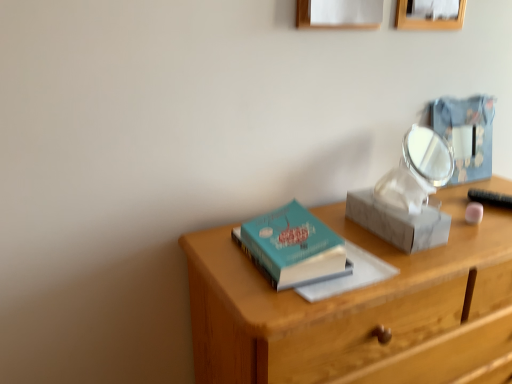
The height and width of the screenshot is (384, 512). Find the location of `free spot above teal matte hardcover book at center (from a real-world perspective)`. free spot above teal matte hardcover book at center (from a real-world perspective) is located at coordinates tap(282, 240).